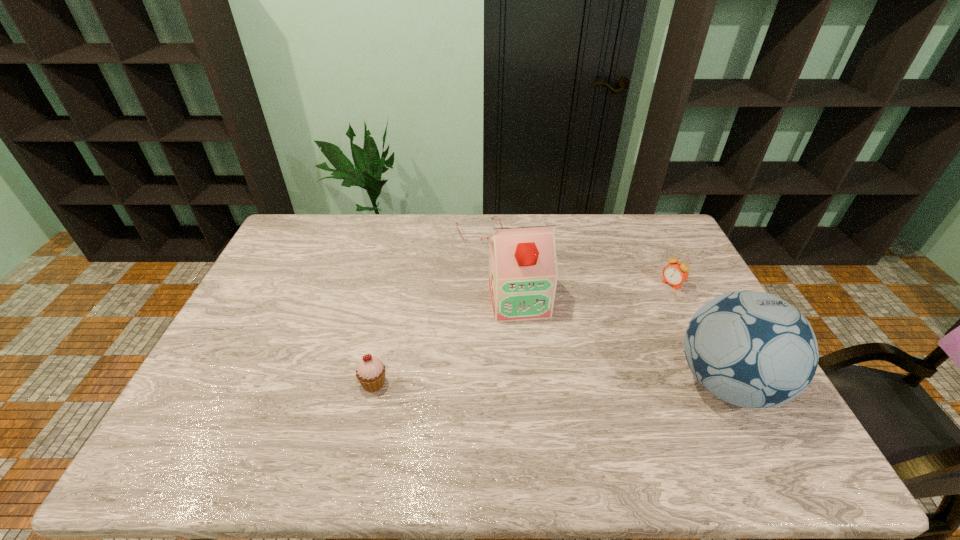
Find the location of a particular element. The image size is (960, 540). free space on the desktop that is between the leftmost object and the soccer ball and is positioned with the cap open on the soya milk is located at coordinates (539, 383).

Where is `free space on the desktop that is between the cupcake and the soccer ball and is positioned on the face of the alarm clock`? The width and height of the screenshot is (960, 540). free space on the desktop that is between the cupcake and the soccer ball and is positioned on the face of the alarm clock is located at coordinates (532, 383).

Where is `free space on the desktop that is between the cupcake and the soccer ball and is positioned on the lenses of the farthest object`? free space on the desktop that is between the cupcake and the soccer ball and is positioned on the lenses of the farthest object is located at coordinates (550, 383).